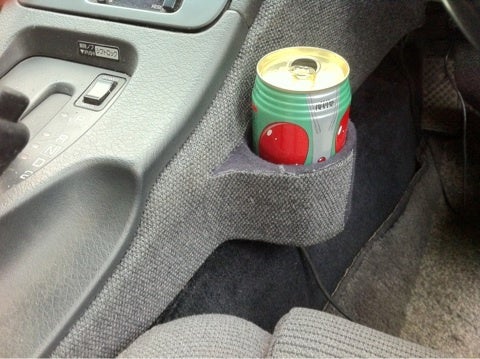
The width and height of the screenshot is (480, 359). Find the location of `floormat`. floormat is located at coordinates (437, 272).